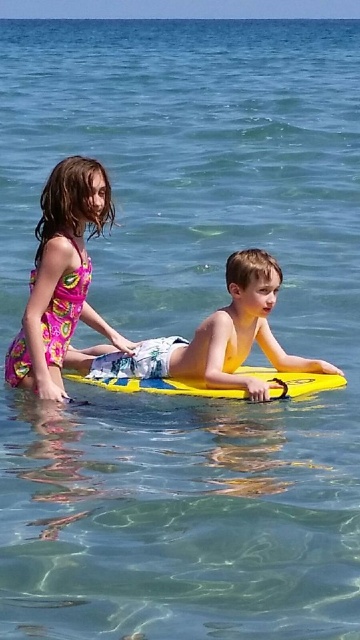
Question: Which of these objects is positioned closest to the yellow foam surfboard at center?

Choices:
 (A) floral dress at left
 (B) yellow foam board at center

Answer: (B)

Question: Is floral dress at left below yellow foam board at center?

Choices:
 (A) yes
 (B) no

Answer: (B)

Question: Which point is farther from the camera taking this photo?

Choices:
 (A) (234, 282)
 (B) (83, 205)

Answer: (A)

Question: Which of the following is the farthest from the observer?

Choices:
 (A) yellow foam board at center
 (B) floral dress at left
 (C) yellow foam surfboard at center

Answer: (B)

Question: Does floral dress at left come in front of yellow foam surfboard at center?

Choices:
 (A) yes
 (B) no

Answer: (B)

Question: Does yellow foam board at center come behind yellow foam surfboard at center?

Choices:
 (A) yes
 (B) no

Answer: (B)